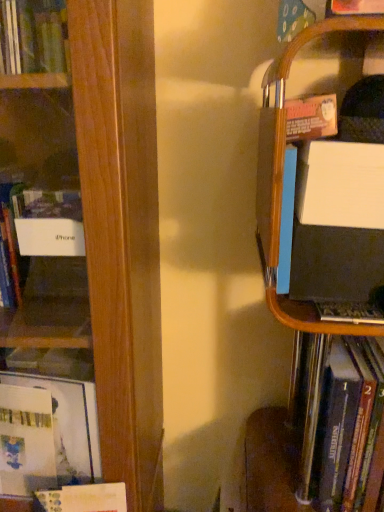
Question: Would you say matte black laptop at right is inside or outside white paper at lower left, the second book viewed from the left?

Choices:
 (A) inside
 (B) outside

Answer: (B)

Question: From the image's perspective, is matte black laptop at right above or below white paper at lower left, the second book viewed from the left?

Choices:
 (A) below
 (B) above

Answer: (B)

Question: Considering the real-world distances, which object is farthest from the black matte laptop at right, which is counted as the first book, starting from the right?

Choices:
 (A) white paper at lower left, the second book viewed from the left
 (B) wooden bookshelf at left, which ranks as the first book in left-to-right order
 (C) matte black laptop at right

Answer: (B)

Question: Estimate the real-world distances between objects in this image. Which object is closer to the black matte laptop at right, which is counted as the first book, starting from the right?

Choices:
 (A) matte black laptop at right
 (B) wooden bookshelf at left, which ranks as the first book in left-to-right order
 (C) white paper at lower left, the second book viewed from the right

Answer: (A)